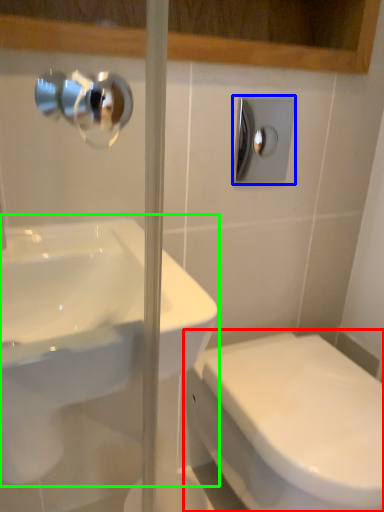
Question: Which object is the closest to the toilet (highlighted by a red box)? Choose among these: shower (highlighted by a blue box) or sink (highlighted by a green box).

Choices:
 (A) shower
 (B) sink

Answer: (B)